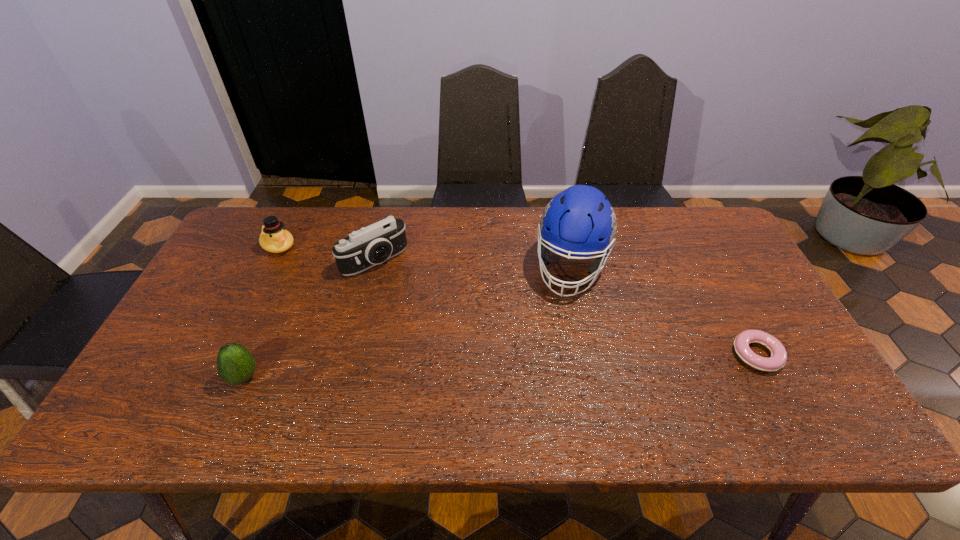
The image size is (960, 540). I want to click on avocado, so click(236, 365).

The width and height of the screenshot is (960, 540). In order to click on the rightmost object in this screenshot , I will do `click(778, 358)`.

This screenshot has height=540, width=960. Identify the location of the shortest object. (778, 358).

Locate an element on the screen. The image size is (960, 540). the third object from right to left is located at coordinates (374, 244).

Locate an element on the screen. football helmet is located at coordinates (580, 221).

In order to click on the tallest object in this screenshot , I will do `click(580, 221)`.

At what (x,y) coordinates should I click in order to perform the action: click on duck. Please return your answer as a coordinate pair (x, y). This screenshot has height=540, width=960. Looking at the image, I should click on (274, 238).

At what (x,y) coordinates should I click in order to perform the action: click on free space located 0.150m on the right of the avocado. Please return your answer as a coordinate pair (x, y). The width and height of the screenshot is (960, 540). Looking at the image, I should click on (324, 377).

Locate an element on the screen. free region located 0.060m on the back of the rightmost object is located at coordinates (737, 318).

At what (x,y) coordinates should I click in order to perform the action: click on free region located on the front lens of the camera. Please return your answer as a coordinate pair (x, y). Looking at the image, I should click on (420, 305).